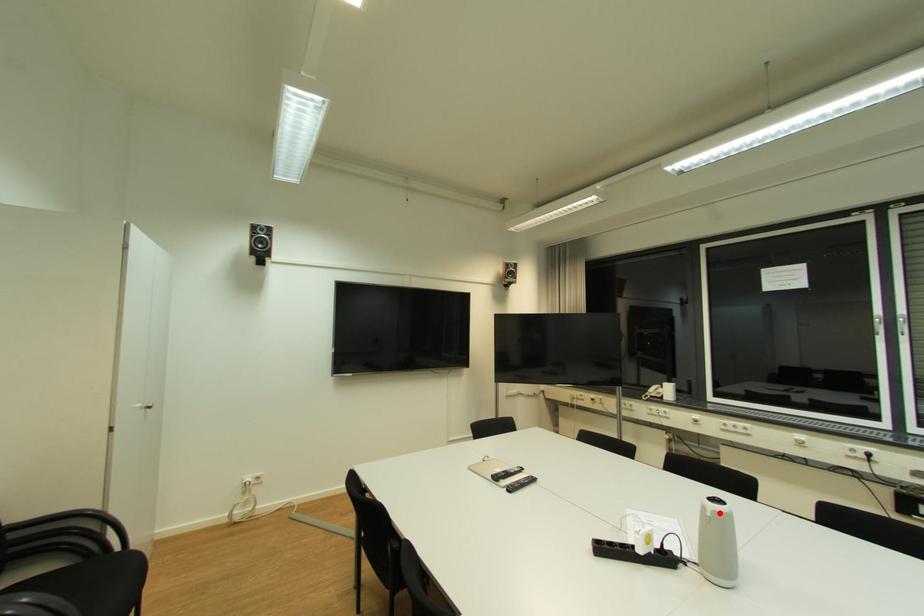
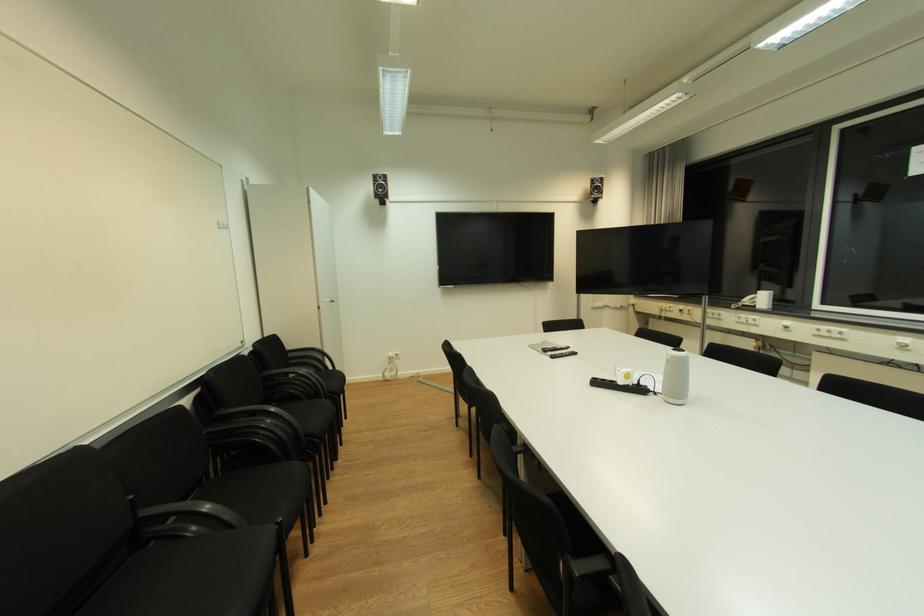
Find the pixel in the second image that matches the highlighted location in the first image.

(678, 358)